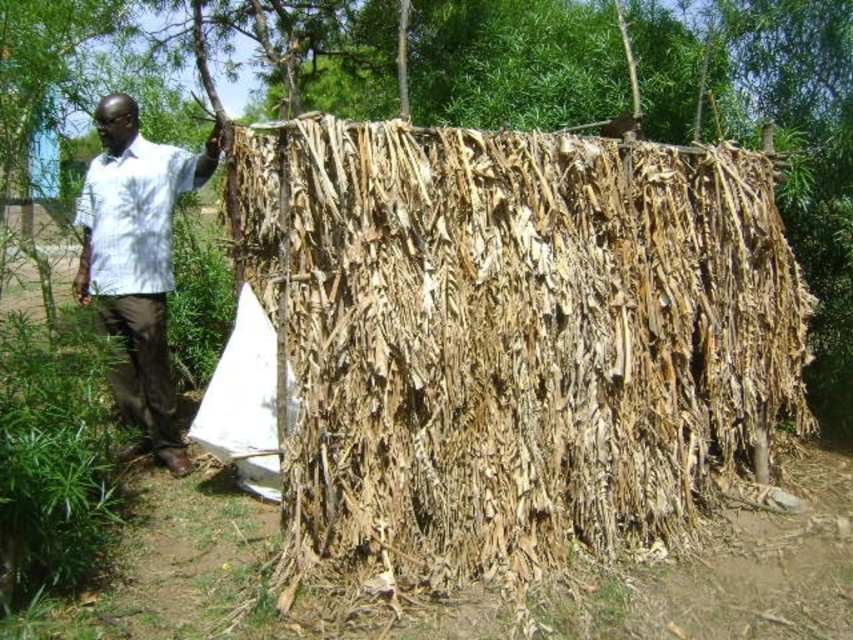
Question: Which is farther from the brown dried leaves at center?

Choices:
 (A) white shirt at left
 (B) white textured shirt at left

Answer: (B)

Question: Does brown dried leaves at center have a lesser width compared to white shirt at left?

Choices:
 (A) no
 (B) yes

Answer: (A)

Question: Can you confirm if white shirt at left is bigger than white textured shirt at left?

Choices:
 (A) yes
 (B) no

Answer: (A)

Question: Considering the relative positions of brown dried leaves at center and white shirt at left in the image provided, where is brown dried leaves at center located with respect to white shirt at left?

Choices:
 (A) below
 (B) above

Answer: (A)

Question: Estimate the real-world distances between objects in this image. Which object is closer to the white shirt at left?

Choices:
 (A) brown dried leaves at center
 (B) white textured shirt at left

Answer: (B)

Question: Which of the following is the closest to the observer?

Choices:
 (A) (90, 289)
 (B) (100, 291)

Answer: (B)